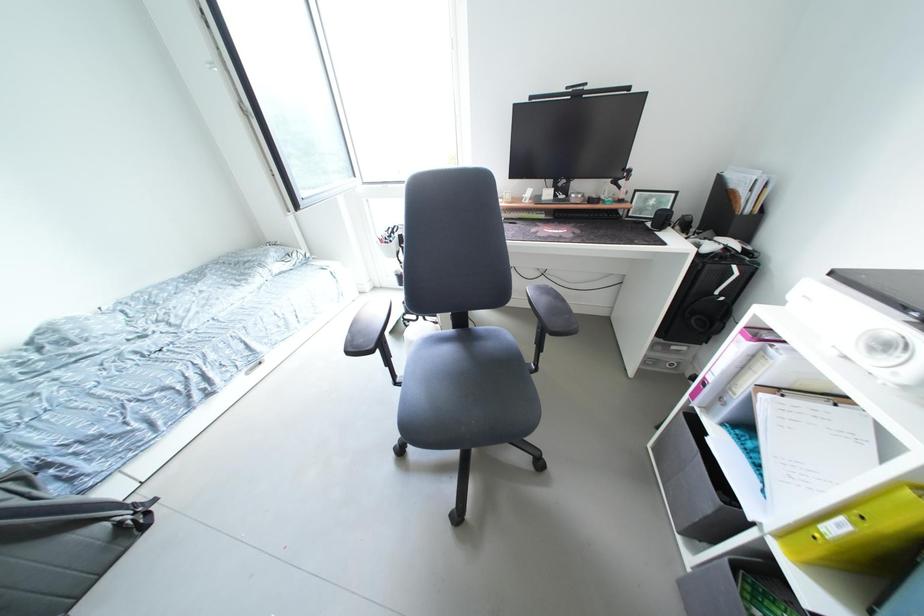
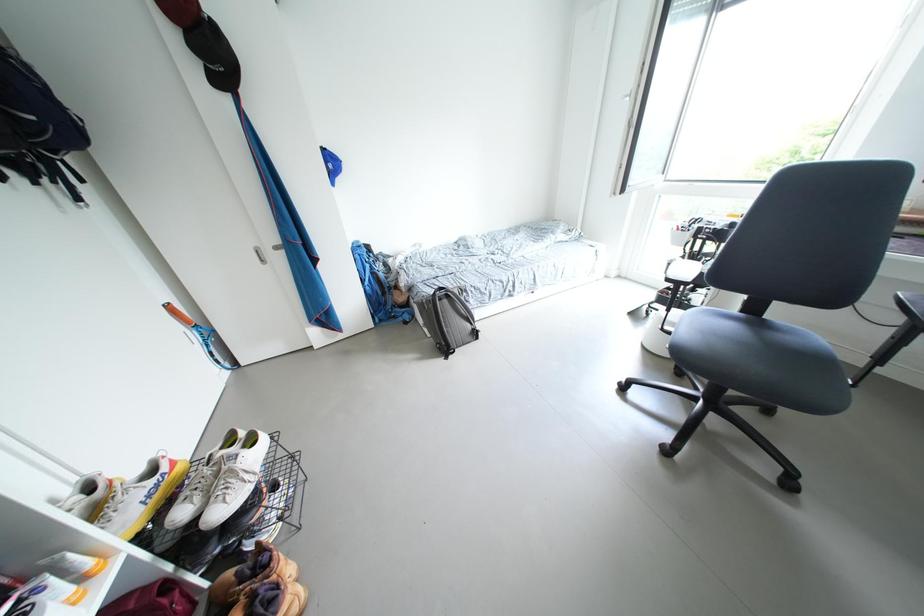
Question: How did the camera likely rotate?

Choices:
 (A) Left
 (B) Right
 (C) Up
 (D) Down

Answer: (A)